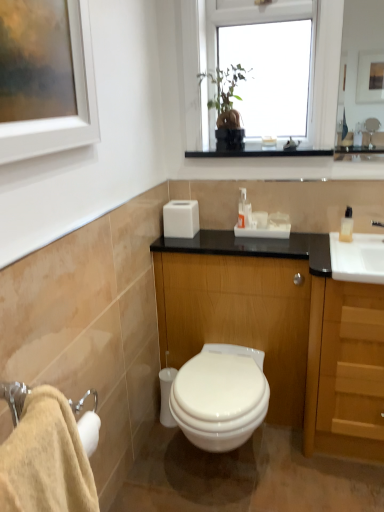
Image resolution: width=384 pixels, height=512 pixels. Find the location of `clear plastic soap dispenser at right`. clear plastic soap dispenser at right is located at coordinates (346, 226).

Measure the distance between wooden cabinet at center and camera.

The depth of wooden cabinet at center is 1.54 meters.

I want to click on transparent glass window at upper center, so click(254, 24).

Locate an element on the screen. white glossy toilet at center is located at coordinates (220, 397).

From a real-world perspective, which is physically above, white glossy toilet at center or clear plastic soap dispenser at right?

clear plastic soap dispenser at right, from a real-world perspective.

Is white glossy toilet at center oriented away from clear plastic soap dispenser at right?

No, white glossy toilet at center's orientation is not away from clear plastic soap dispenser at right.

Is the surface of white glossy toilet at center in direct contact with clear plastic soap dispenser at right?

No, white glossy toilet at center is not beside clear plastic soap dispenser at right.

In order to click on toilet to the left of clear plastic soap dispenser at right in this screenshot , I will do `click(220, 397)`.

Who is smaller, clear plastic soap dispenser at right or white glossy toilet at center?

Smaller between the two is clear plastic soap dispenser at right.

From the picture: Can you confirm if clear plastic soap dispenser at right is positioned to the right of white glossy toilet at center?

Yes.

From a real-world perspective, relative to white glossy toilet at center, is clear plastic soap dispenser at right vertically above or below?

clear plastic soap dispenser at right is above white glossy toilet at center.

Consider the image. Can you see clear plastic soap dispenser at right touching white glossy toilet at center?

clear plastic soap dispenser at right and white glossy toilet at center are clearly separated.

Are beige cotton bath towel at lower left and wooden cabinet at center making contact?

beige cotton bath towel at lower left and wooden cabinet at center are clearly separated.

From the image's perspective, which one is positioned higher, beige cotton bath towel at lower left or wooden cabinet at center?

wooden cabinet at center appears higher in the image.

Considering the sizes of objects beige cotton bath towel at lower left and wooden cabinet at center in the image provided, who is smaller, beige cotton bath towel at lower left or wooden cabinet at center?

Smaller between the two is beige cotton bath towel at lower left.

Is point (81, 510) positioned behind point (172, 245)?

No, it is not.

Looking at this image, from the image's perspective, which object appears higher, clear plastic soap dispenser at right or wooden cabinet at center?

clear plastic soap dispenser at right is shown above in the image.

Is clear plastic soap dispenser at right further to the viewer compared to wooden cabinet at center?

Yes, the depth of clear plastic soap dispenser at right is greater than that of wooden cabinet at center.

Identify the location of bathroom cabinet on the left of clear plastic soap dispenser at right. (282, 330).

Considering the relative sizes of clear plastic soap dispenser at right and beige cotton bath towel at lower left in the image provided, is clear plastic soap dispenser at right wider than beige cotton bath towel at lower left?

No, clear plastic soap dispenser at right is not wider than beige cotton bath towel at lower left.

Does clear plastic soap dispenser at right have a lesser height compared to beige cotton bath towel at lower left?

Yes, clear plastic soap dispenser at right is shorter than beige cotton bath towel at lower left.

What's the angular difference between clear plastic soap dispenser at right and beige cotton bath towel at lower left's facing directions?

The angular difference between clear plastic soap dispenser at right and beige cotton bath towel at lower left is 101 degrees.

Can you confirm if white plastic soap dispenser at center is taller than clear plastic soap dispenser at right?

Yes, white plastic soap dispenser at center is taller than clear plastic soap dispenser at right.

Is white plastic soap dispenser at center facing towards clear plastic soap dispenser at right?

No, white plastic soap dispenser at center is not facing towards clear plastic soap dispenser at right.

Is white plastic soap dispenser at center positioned in front of clear plastic soap dispenser at right?

No, white plastic soap dispenser at center is behind clear plastic soap dispenser at right.

How different are the orientations of white plastic soap dispenser at center and clear plastic soap dispenser at right in degrees?

The angular difference between white plastic soap dispenser at center and clear plastic soap dispenser at right is 7.04 degrees.

Looking at their sizes, would you say wooden cabinet at center is wider or thinner than white plastic soap dispenser at center?

In the image, wooden cabinet at center appears to be wider than white plastic soap dispenser at center.

From a real-world perspective, is wooden cabinet at center above or below white plastic soap dispenser at center?

Clearly, from a real-world perspective, wooden cabinet at center is below white plastic soap dispenser at center.

Is wooden cabinet at center inside or outside of white plastic soap dispenser at center?

wooden cabinet at center is spatially situated outside white plastic soap dispenser at center.

At what (x,y) coordinates should I click in order to perform the action: click on soap dispenser above the white glossy toilet at center (from a real-world perspective). Please return your answer as a coordinate pair (x, y). Looking at the image, I should click on (346, 226).

Image resolution: width=384 pixels, height=512 pixels. In order to click on toilet that is below the clear plastic soap dispenser at right (from the image's perspective) in this screenshot , I will do `click(220, 397)`.

From the image, which object appears to be farther from light wood/wooden cabinet at right, white glossy toilet at center or beige cotton bath towel at lower left?

beige cotton bath towel at lower left lies further to light wood/wooden cabinet at right than the other object.

From the image, which object appears to be farther from beige cotton bath towel at lower left, white plastic soap dispenser at center or light wood/wooden cabinet at right?

Based on the image, white plastic soap dispenser at center appears to be further to beige cotton bath towel at lower left.

Based on their spatial positions, is wooden cabinet at center or white plastic soap dispenser at center closer to transparent glass window at upper center?

Based on the image, white plastic soap dispenser at center appears to be nearer to transparent glass window at upper center.

Which object lies nearer to the anchor point white glossy toilet at center, transparent glass window at upper center or white plastic soap dispenser at center?

white plastic soap dispenser at center is closer to white glossy toilet at center.

Looking at the image, which one is located further to beige cotton bath towel at lower left, white plastic soap dispenser at center or transparent glass window at upper center?

transparent glass window at upper center is further to beige cotton bath towel at lower left.

Looking at the image, which one is located further to beige cotton bath towel at lower left, clear plastic soap dispenser at right or light wood/wooden cabinet at right?

Among the two, clear plastic soap dispenser at right is located further to beige cotton bath towel at lower left.

From the image, which object appears to be nearer to white plastic soap dispenser at center, wooden cabinet at center or clear plastic soap dispenser at right?

clear plastic soap dispenser at right is closer to white plastic soap dispenser at center.

Considering their positions, is transparent glass window at upper center positioned further to light wood/wooden cabinet at right than white glossy toilet at center?

Based on the image, transparent glass window at upper center appears to be further to light wood/wooden cabinet at right.

Identify the location of cabinetry between transparent glass window at upper center and white glossy toilet at center from top to bottom. The height and width of the screenshot is (512, 384). (345, 370).

Identify the location of cabinetry between beige cotton bath towel at lower left and wooden cabinet at center from front to back. The height and width of the screenshot is (512, 384). (345, 370).

Locate an element on the screen. The height and width of the screenshot is (512, 384). toiletry that lies between transparent glass window at upper center and wooden cabinet at center from top to bottom is located at coordinates (244, 210).

The height and width of the screenshot is (512, 384). Find the location of `cabinetry between beige cotton bath towel at lower left and clear plastic soap dispenser at right in the front-back direction`. cabinetry between beige cotton bath towel at lower left and clear plastic soap dispenser at right in the front-back direction is located at coordinates (345, 370).